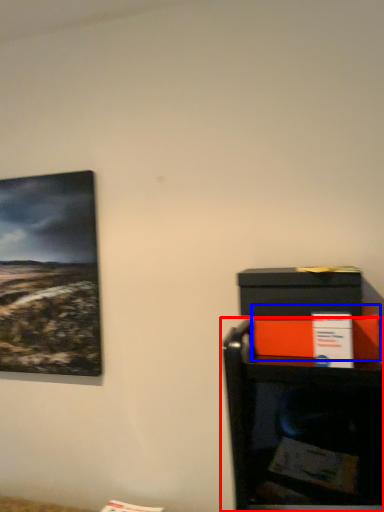
Question: Which object is further to the camera taking this photo, furniture (highlighted by a red box) or box (highlighted by a blue box)?

Choices:
 (A) furniture
 (B) box

Answer: (A)